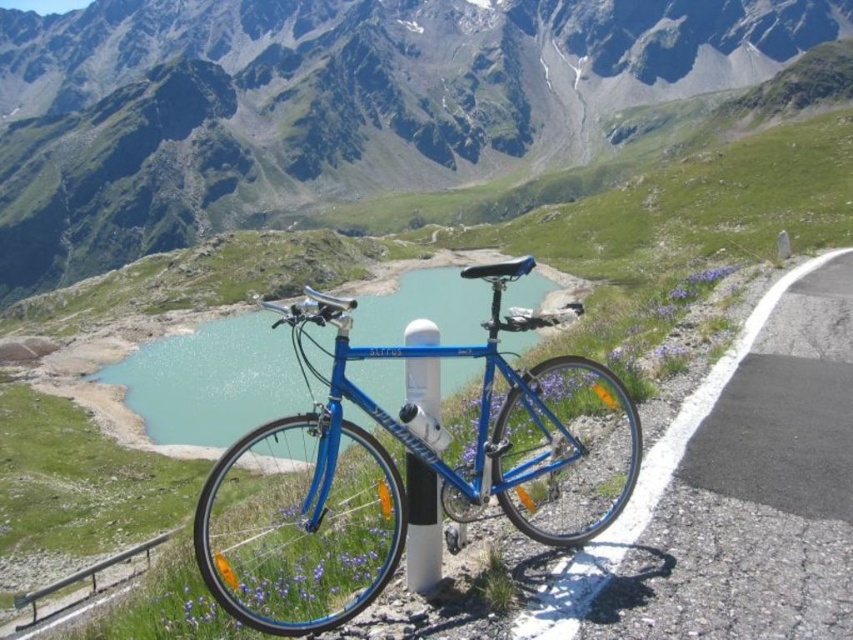
You are standing on a mountain road and see two points marked in the scene. Which point is closer to you, point (160, 40) or point (3, 627)?

Point (160, 40) is further to the viewer than point (3, 627), so point (3, 627) is closer to you.

You are a photographer planning to take a photo of the matte blue bicycle at center and the blue metallic bicycle at center. Which bicycle should you focus on first if you want to capture the larger one in your frame?

The matte blue bicycle at center is larger in size than the blue metallic bicycle at center, so you should focus on the matte blue bicycle at center first to capture the larger one in your frame.